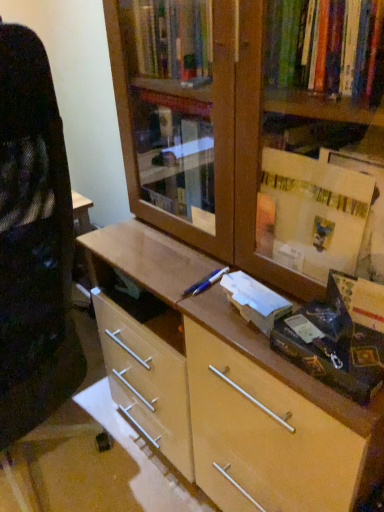
Question: Considering the positions of white paper at center and blue metallic pen at center in the image, is white paper at center wider or thinner than blue metallic pen at center?

Choices:
 (A) thin
 (B) wide

Answer: (A)

Question: Is white paper at center inside the boundaries of blue metallic pen at center, or outside?

Choices:
 (A) outside
 (B) inside

Answer: (A)

Question: Considering the positions of white paper at center and blue metallic pen at center in the image, is white paper at center bigger or smaller than blue metallic pen at center?

Choices:
 (A) small
 (B) big

Answer: (B)

Question: Considering the positions of blue metallic pen at center and white paper at center in the image, is blue metallic pen at center wider or thinner than white paper at center?

Choices:
 (A) wide
 (B) thin

Answer: (A)

Question: Looking at the image, does blue metallic pen at center seem bigger or smaller compared to white paper at center?

Choices:
 (A) small
 (B) big

Answer: (A)

Question: Is blue metallic pen at center taller or shorter than white paper at center?

Choices:
 (A) tall
 (B) short

Answer: (B)

Question: Considering the relative positions of blue metallic pen at center and white paper at center in the image provided, is blue metallic pen at center to the left or to the right of white paper at center?

Choices:
 (A) right
 (B) left

Answer: (B)